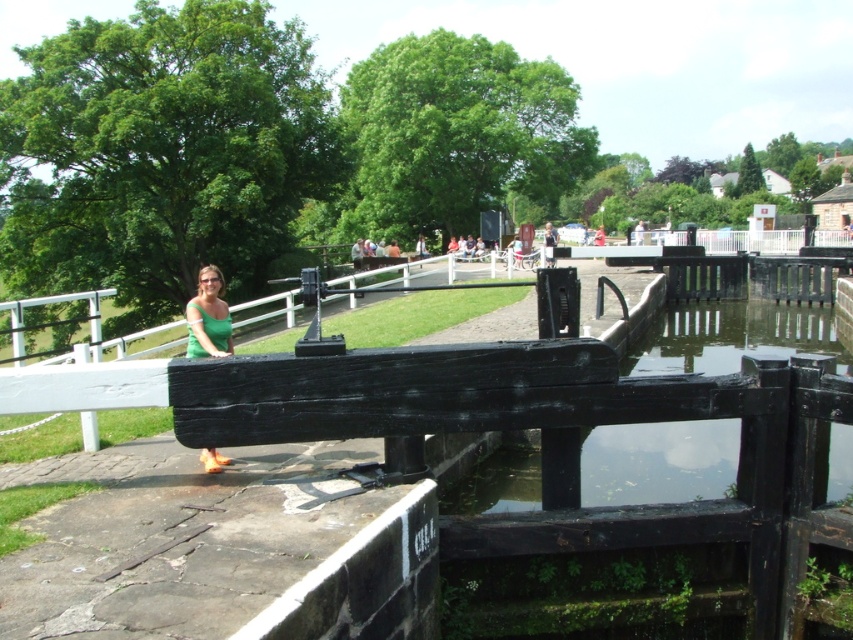
Which of these two, transparent water at lock center or green matte shirt at center, stands shorter?

Standing shorter between the two is transparent water at lock center.

Does transparent water at lock center have a larger size compared to green matte shirt at center?

No.

Is point (730, 369) positioned before point (212, 326)?

No, it is behind (212, 326).

This screenshot has height=640, width=853. What are the coordinates of `transparent water at lock center` in the screenshot? It's located at (659, 461).